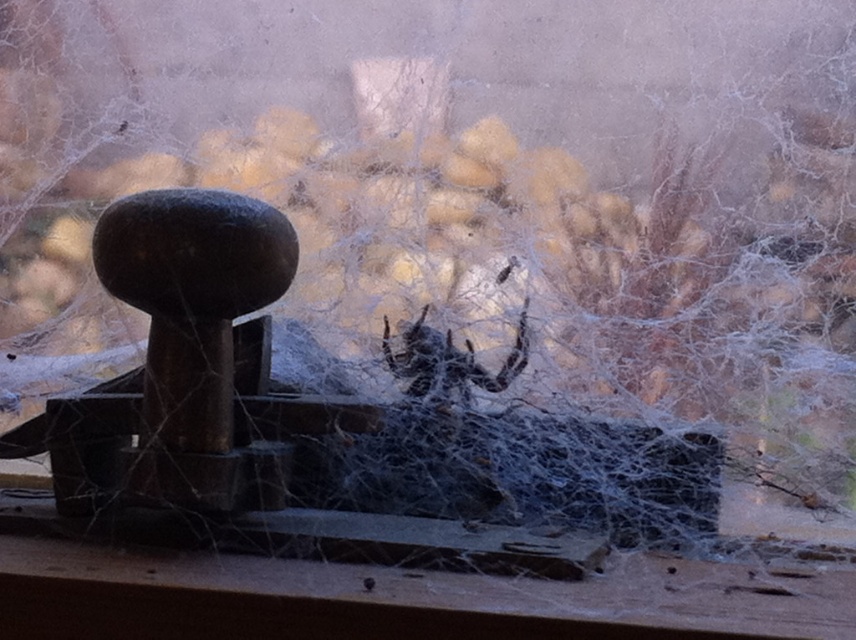
Does wooden at lower center have a lesser width compared to dark brown fuzzy spider at center?

No.

The height and width of the screenshot is (640, 856). What do you see at coordinates (403, 598) in the screenshot? I see `wooden at lower center` at bounding box center [403, 598].

You are a GUI agent. You are given a task and a screenshot of the screen. Output one action in this format:
    pyautogui.click(x=<x>, y=<y>)
    Task: Click on the wooden at lower center
    Image resolution: width=856 pixels, height=640 pixels.
    Given the screenshot: What is the action you would take?
    pyautogui.click(x=403, y=598)